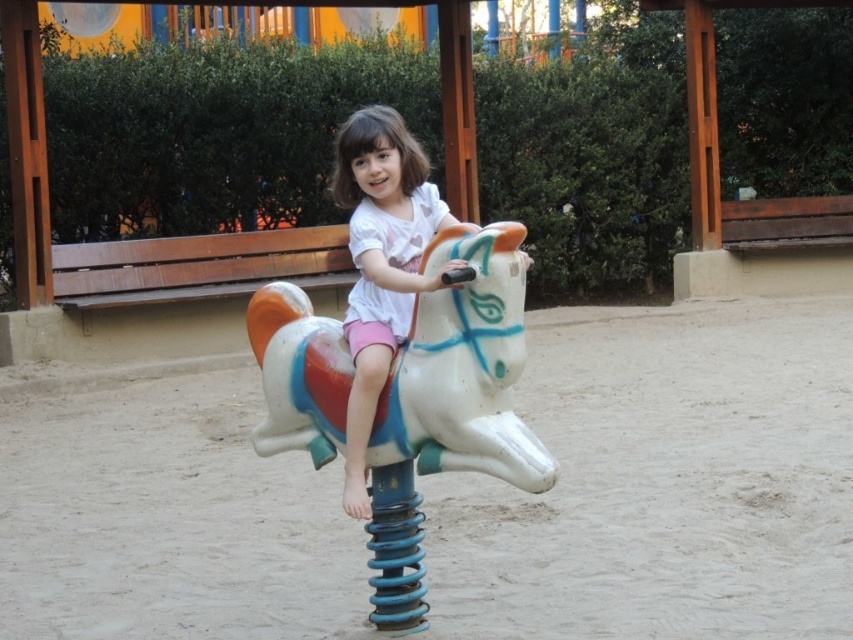
You are standing at the point marked by the coordinates point (663, 481). What is the object located at this point in the playground scene?

The point (663, 481) marks the white sandy ground at center.

You are a parent at the playground and see your child playing with the white plastic horse at center and the matte white horse at center. Which one is bigger?

The white plastic horse at center is larger in size than the matte white horse at center.